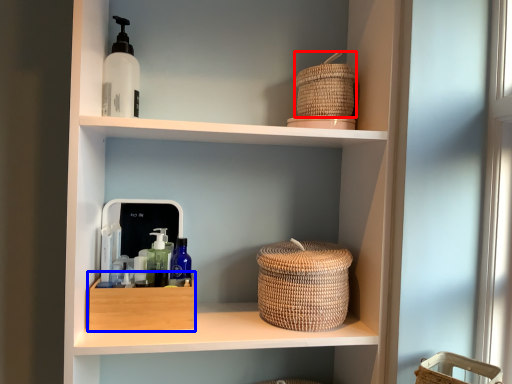
Question: Which of the following is the closest to the observer, basket (highlighted by a red box) or storage box (highlighted by a blue box)?

Choices:
 (A) basket
 (B) storage box

Answer: (B)